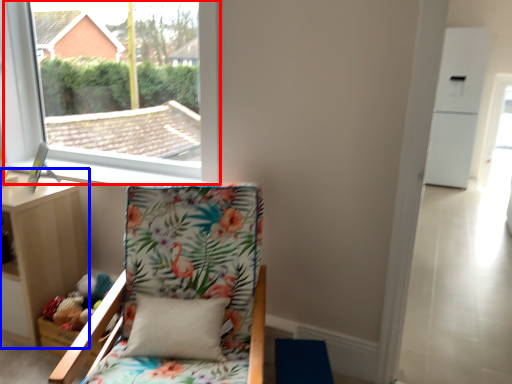
Question: Among these objects, which one is farthest to the camera, window (highlighted by a red box) or nightstand (highlighted by a blue box)?

Choices:
 (A) window
 (B) nightstand

Answer: (B)